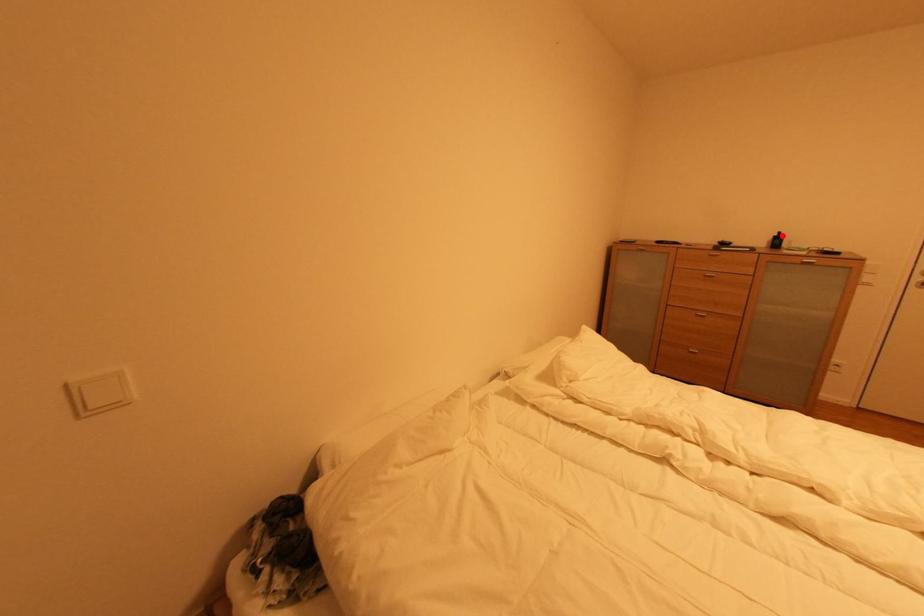
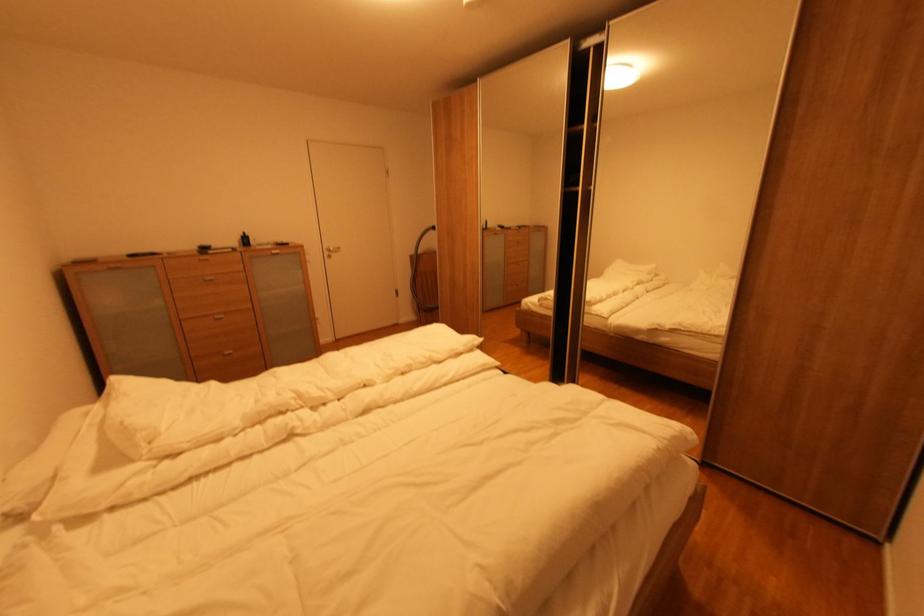
Where in the second image is the point corresponding to the highlighted location from the first image?

(248, 237)